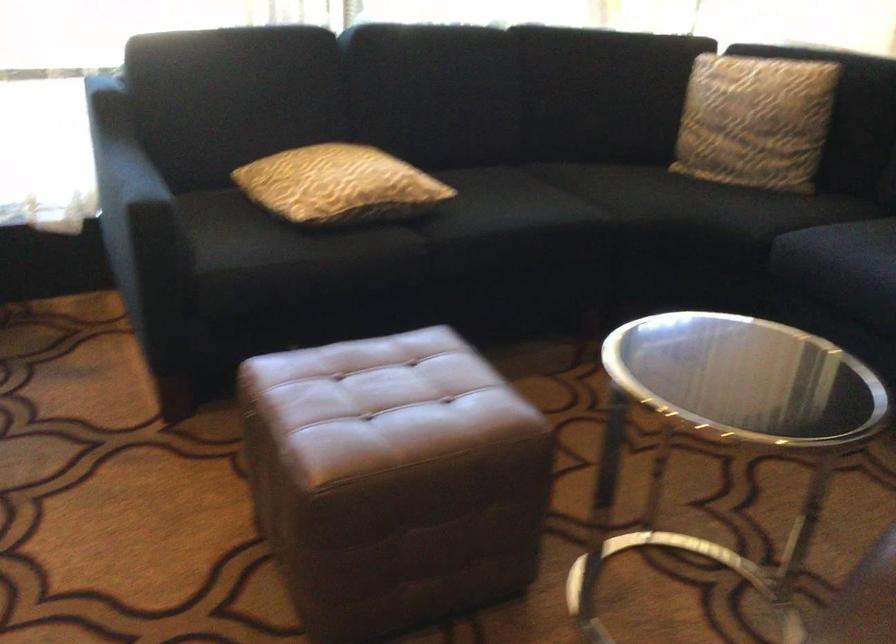
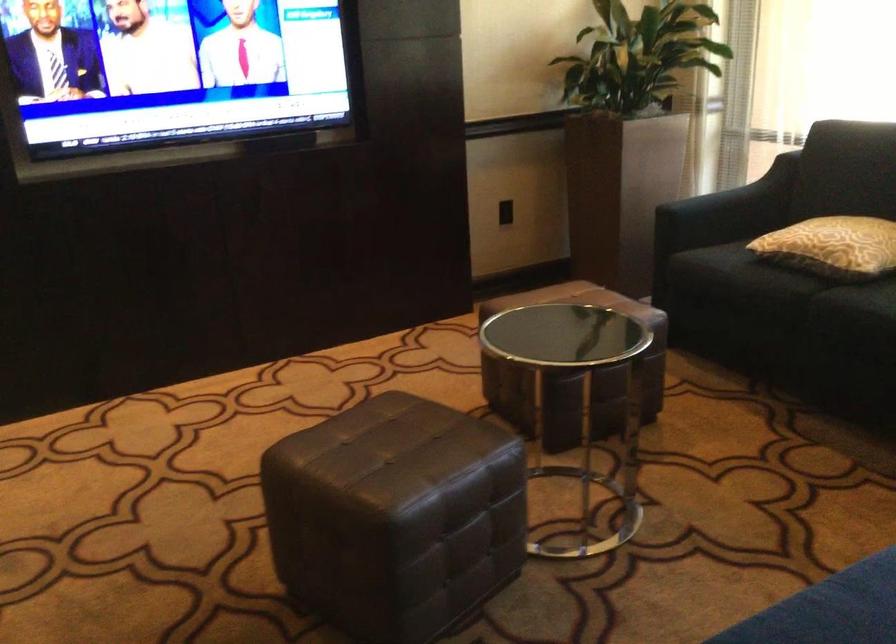
In the second image, find the point that corresponds to (x=369, y=257) in the first image.

(767, 283)